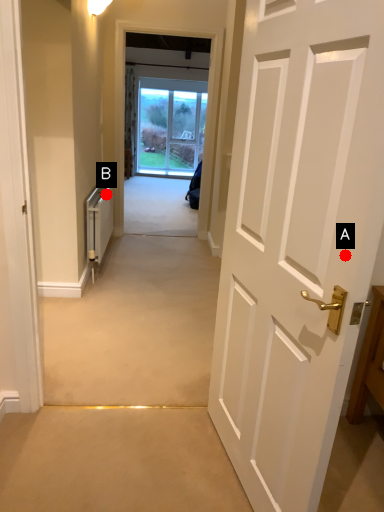
Question: Two points are circled on the image, labeled by A and B beside each circle. Which of the following is the farthest from the observer?

Choices:
 (A) A is further
 (B) B is further

Answer: (B)